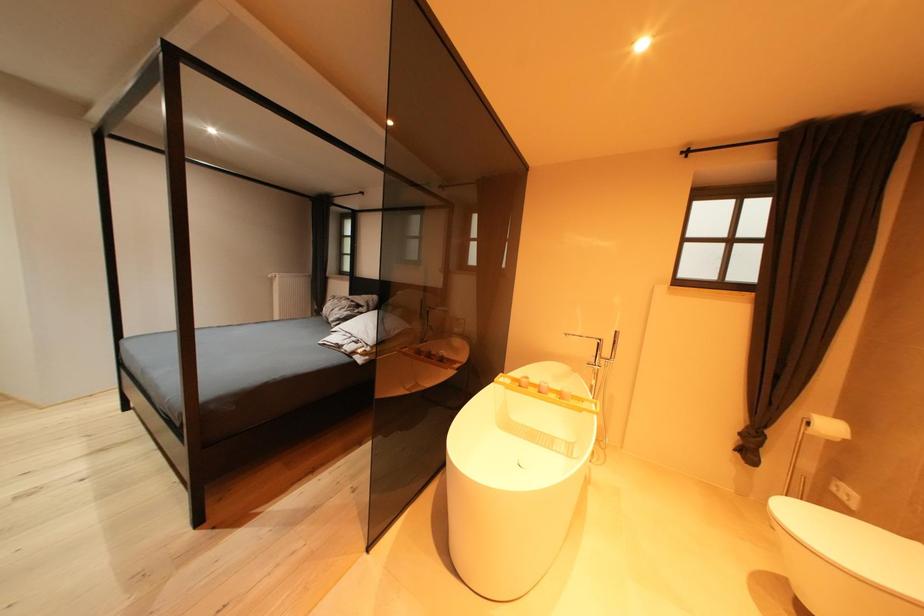
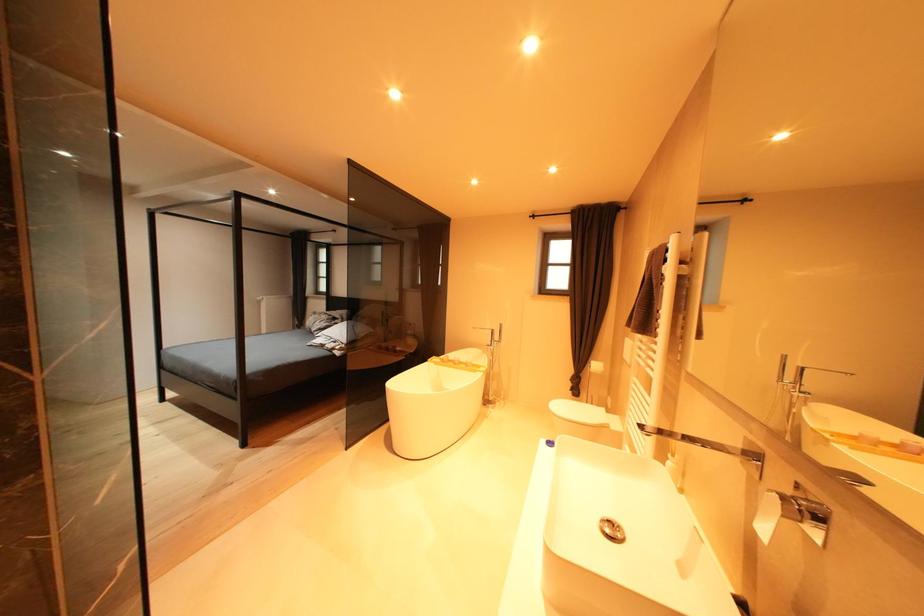
Which direction would the cameraman need to move to produce the second image?

The movement direction of the cameraman is right, backward.